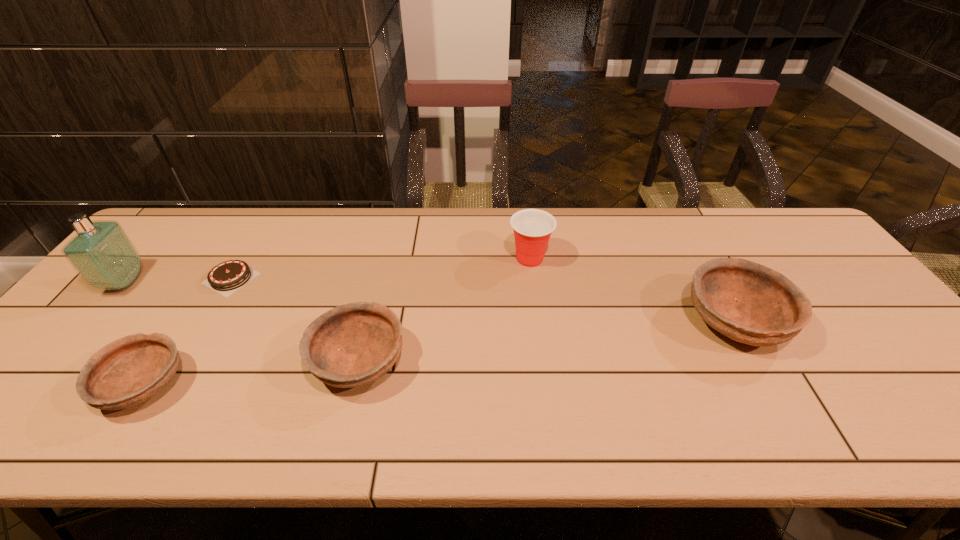
Locate an element on the screen. This screenshot has height=540, width=960. the second shortest object is located at coordinates (128, 371).

Locate an element on the screen. This screenshot has height=540, width=960. the leftmost bowl is located at coordinates (128, 371).

This screenshot has width=960, height=540. Find the location of `the fourth tallest object`. the fourth tallest object is located at coordinates (351, 345).

This screenshot has width=960, height=540. Identify the location of the fourth object from left to right. (351, 345).

This screenshot has width=960, height=540. In order to click on the rightmost bowl in this screenshot , I will do `click(750, 303)`.

This screenshot has width=960, height=540. Find the location of `the second object from right to left`. the second object from right to left is located at coordinates (532, 228).

At what (x,y) coordinates should I click in order to perform the action: click on the second tallest object. Please return your answer as a coordinate pair (x, y). Looking at the image, I should click on (532, 228).

This screenshot has height=540, width=960. I want to click on the shortest object, so click(230, 275).

Find the location of a particular element. perfume is located at coordinates (103, 255).

Locate an element on the screen. the leftmost object is located at coordinates (103, 255).